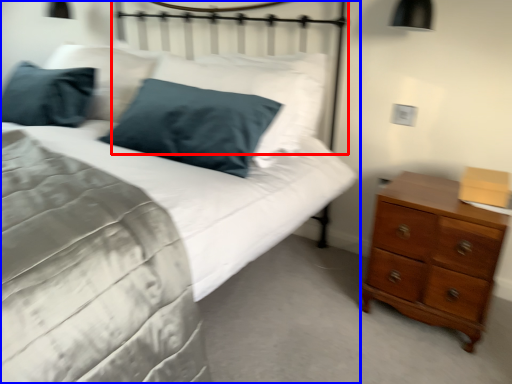
Question: Which of the following is the closest to the observer, headboard (highlighted by a red box) or bed (highlighted by a blue box)?

Choices:
 (A) headboard
 (B) bed

Answer: (B)